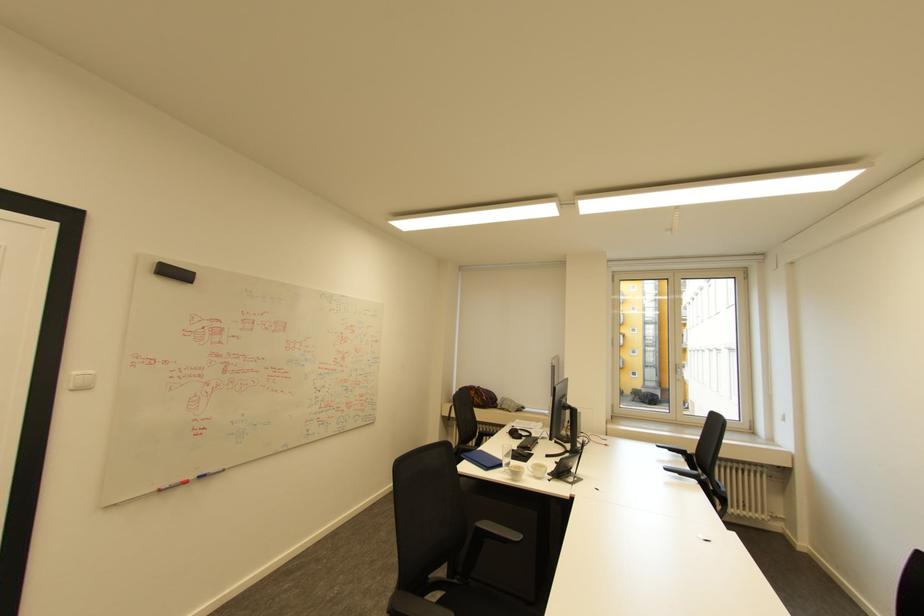
Image resolution: width=924 pixels, height=616 pixels. I want to click on glass of water, so click(x=505, y=455).